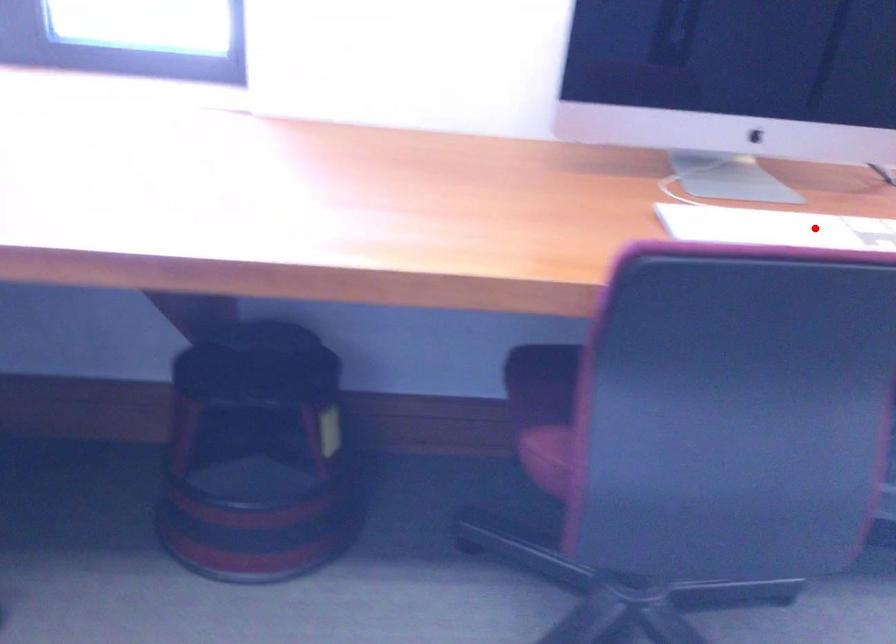
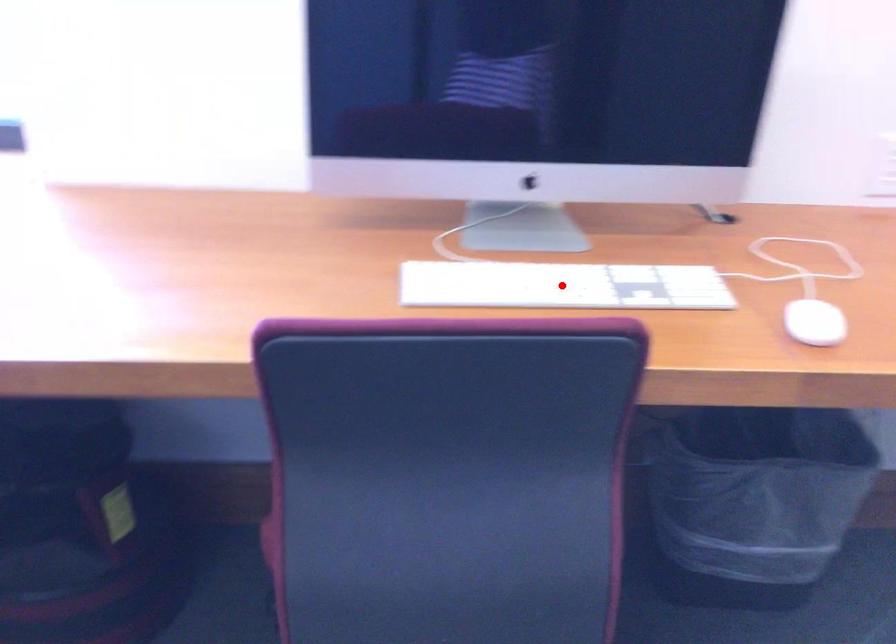
I am providing you with two images of the same scene from different viewpoints. A red point is marked on the first image and another point is marked on the second image. Is the marked point in image1 the same physical position as the marked point in image2?

Yes